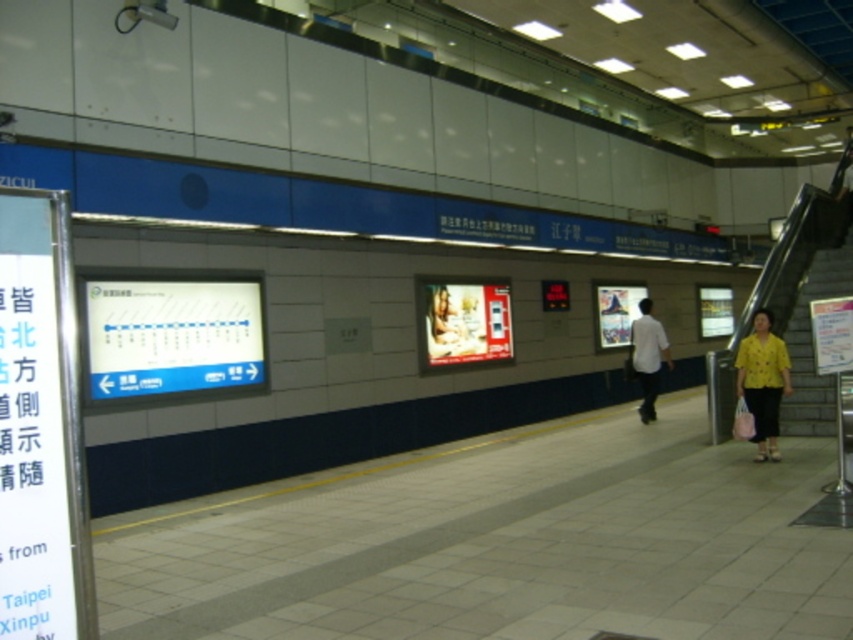
Question: Which point is closer to the camera?

Choices:
 (A) (772, 445)
 (B) (802, 296)
 (C) (643, 326)

Answer: (A)

Question: Does yellow fabric shirt at right come behind white matte shirt at center?

Choices:
 (A) yes
 (B) no

Answer: (B)

Question: Does yellow fabric shirt at right appear on the right side of white matte shirt at center?

Choices:
 (A) no
 (B) yes

Answer: (B)

Question: Which point is farther to the camera?

Choices:
 (A) yellow fabric shirt at right
 (B) yellow fabric escalator at right
 (C) white matte shirt at center

Answer: (B)

Question: Among these points, which one is nearest to the camera?

Choices:
 (A) (650, 320)
 (B) (810, 428)

Answer: (B)

Question: Where is yellow fabric escalator at right located in relation to yellow fabric shirt at right in the image?

Choices:
 (A) above
 (B) below

Answer: (A)